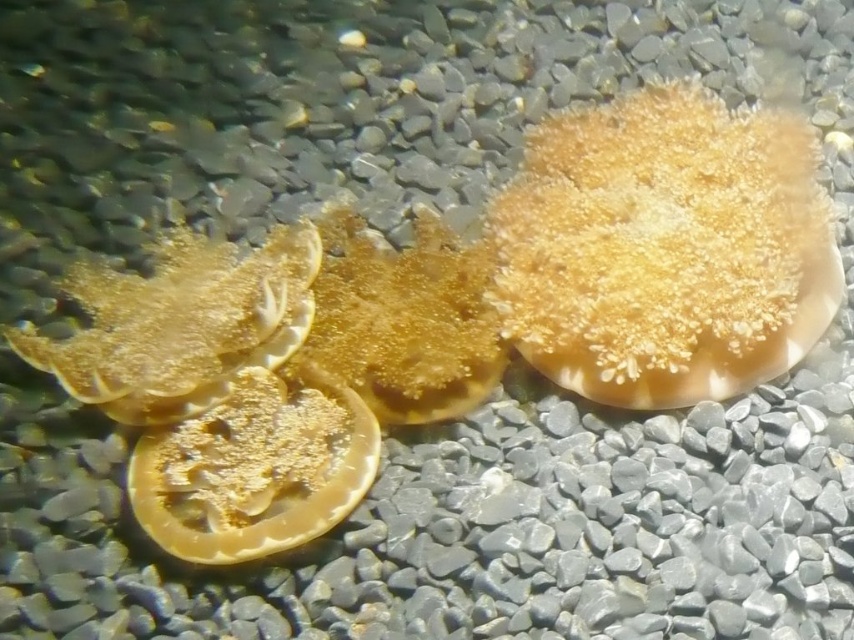
Which of these two, golden textured scallop at center or translucent yellow scallop at center, stands shorter?

With less height is translucent yellow scallop at center.

Looking at this image, which of these two, golden textured scallop at center or translucent yellow scallop at center, stands taller?

Standing taller between the two is golden textured scallop at center.

Between point (521, 266) and point (177, 554), which one is positioned in front?

Point (177, 554) is in front.

You are a GUI agent. You are given a task and a screenshot of the screen. Output one action in this format:
    pyautogui.click(x=<x>, y=<y>)
    Task: Click on the golden textured scallop at center
    The width and height of the screenshot is (854, 640).
    Given the screenshot: What is the action you would take?
    pyautogui.click(x=664, y=248)